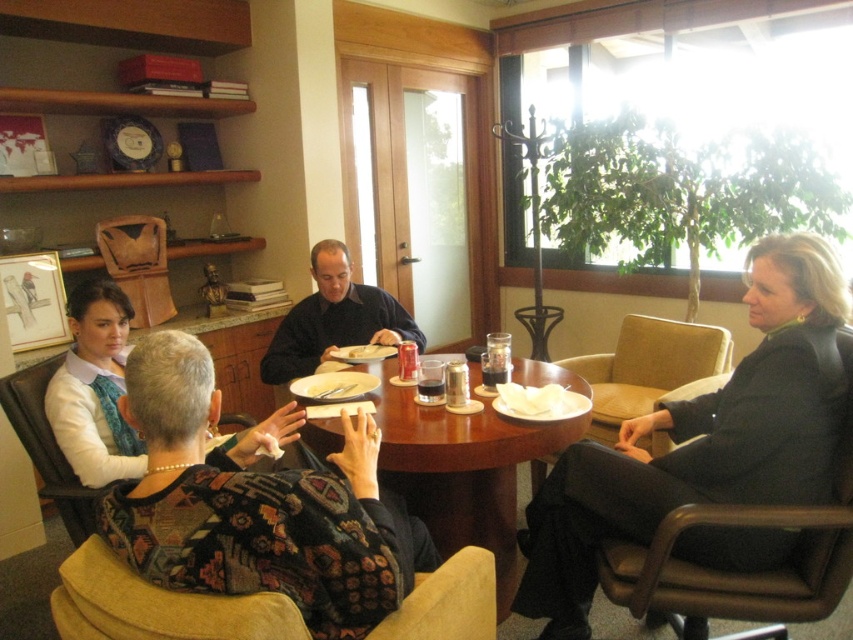
Question: Estimate the real-world distances between objects in this image. Which object is farther from the translucent plastic cup at center?

Choices:
 (A) leather armchair at right
 (B) patterned fabric armchair at lower left
 (C) matte black shirt at center
 (D) floral sweater at center

Answer: (A)

Question: Is matte black shirt at center wider than patterned fabric armchair at lower left?

Choices:
 (A) no
 (B) yes

Answer: (B)

Question: Which object appears farthest from the camera in this image?

Choices:
 (A) leather armchair at right
 (B) black leather jacket at right

Answer: (A)

Question: Where is leather armchair at right located in relation to patterned fabric armchair at lower left in the image?

Choices:
 (A) above
 (B) below

Answer: (A)

Question: Is floral sweater at center below patterned fabric armchair at lower left?

Choices:
 (A) no
 (B) yes

Answer: (B)

Question: Which of the following is the farthest from the observer?

Choices:
 (A) black leather jacket at right
 (B) wooden round table at center
 (C) velvet floral-patterned armchair at lower center

Answer: (B)